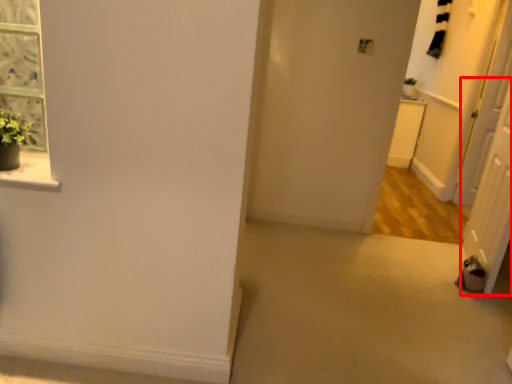
Question: From the image's perspective, considering the relative positions of screen door (annotated by the red box) and screen door in the image provided, where is screen door (annotated by the red box) located with respect to the staircase?

Choices:
 (A) above
 (B) below

Answer: (B)